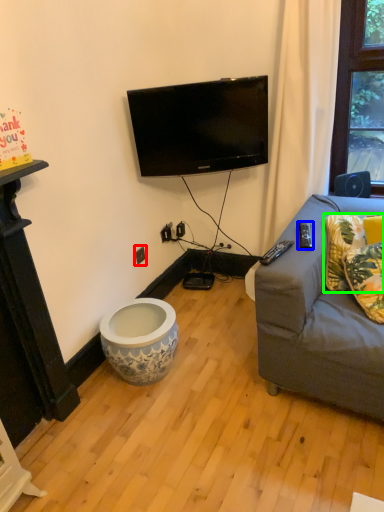
Question: Estimate the real-world distances between objects in this image. Which object is farther from electric outlet (highlighted by a red box), remote control (highlighted by a blue box) or pillow (highlighted by a green box)?

Choices:
 (A) remote control
 (B) pillow

Answer: (B)